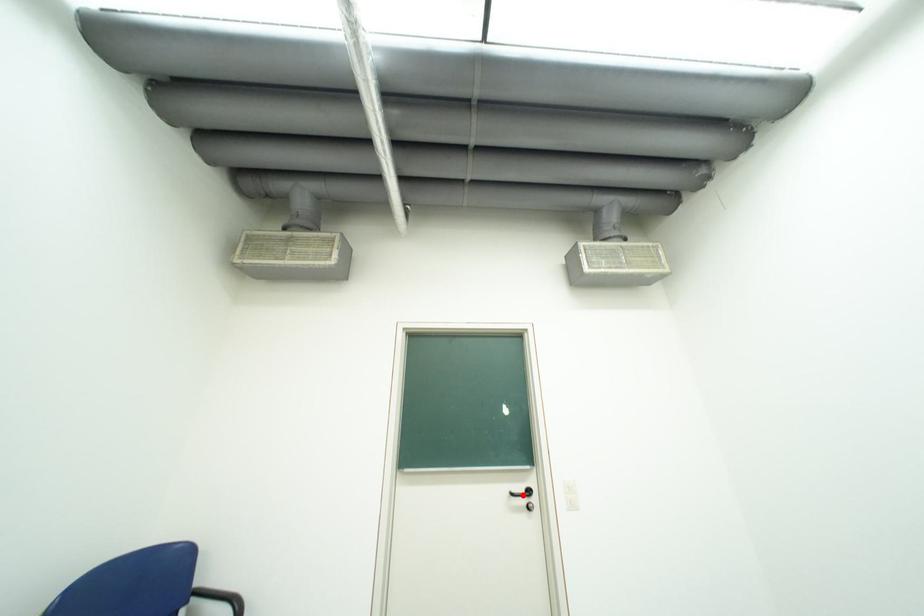
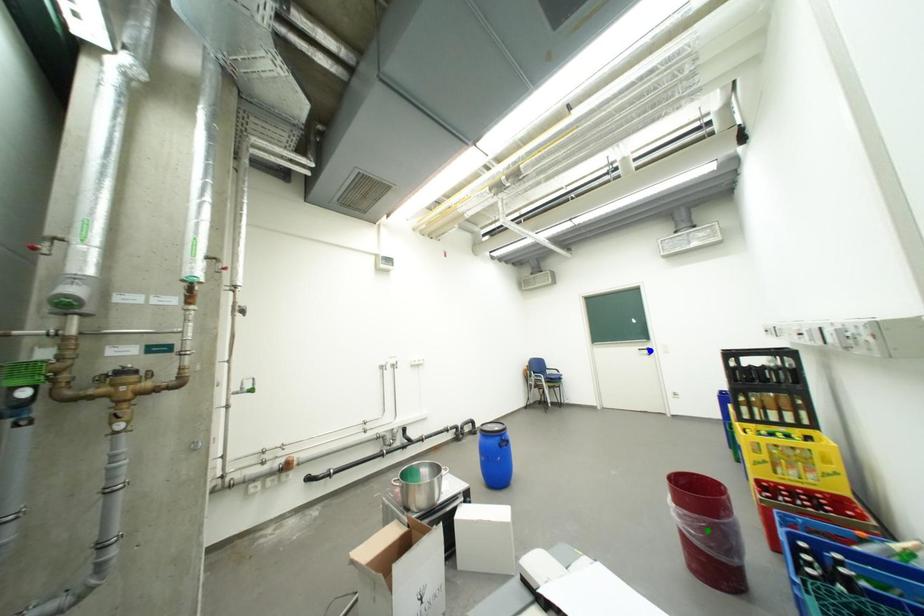
Question: I am providing you with two images of the same scene from different viewpoints. A red point is marked on the first image. You are given multiple points on the second image. Which point in image 2 is actually the same real-world point as the red point in image 1?

Choices:
 (A) yellow point
 (B) green point
 (C) blue point

Answer: (C)